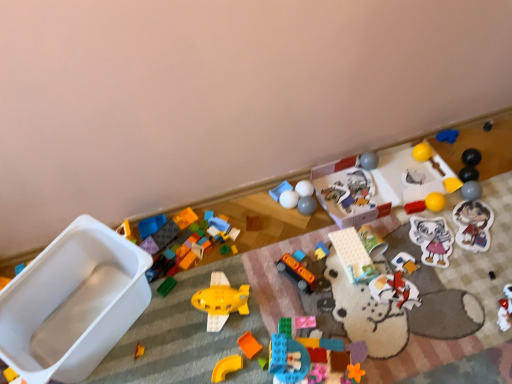
The height and width of the screenshot is (384, 512). Identify the location of vacant area that lies to the right of orange matte block at center, acting as the sixth toy starting from the left. (307, 317).